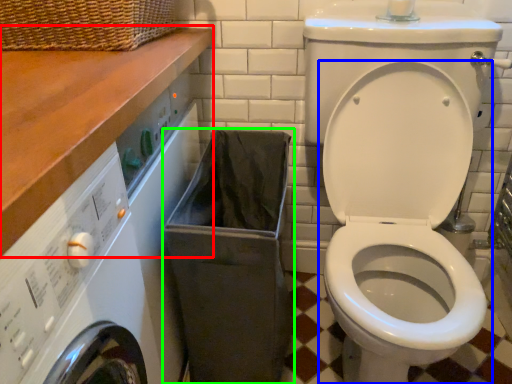
Question: Which is farther away from counter top (highlighted by a red box)? toilet (highlighted by a blue box) or laundry basket (highlighted by a green box)?

Choices:
 (A) toilet
 (B) laundry basket

Answer: (A)